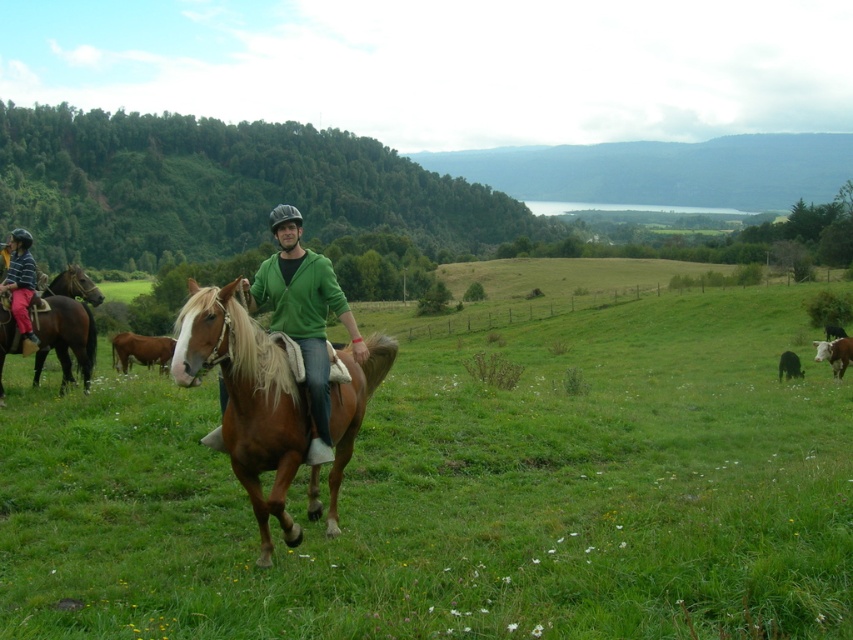
You are standing in the image and want to walk towards the green matte jacket at center. Which direction should you move relative to the green grassy field at center?

The green grassy field at center is closer to the viewer than the green matte jacket at center, so to reach the green matte jacket at center, you should move away from the green grassy field at center.

You are a photographer aiming to capture both the brown glossy horse at left and the brown glossy horse at lower right in a single frame. Based on their positions, which horse should you focus on first to ensure both are in the shot?

The brown glossy horse at left should be focused on first since it is positioned to the left of the brown glossy horse at lower right, allowing the photographer to frame both horses by starting from the leftmost subject.